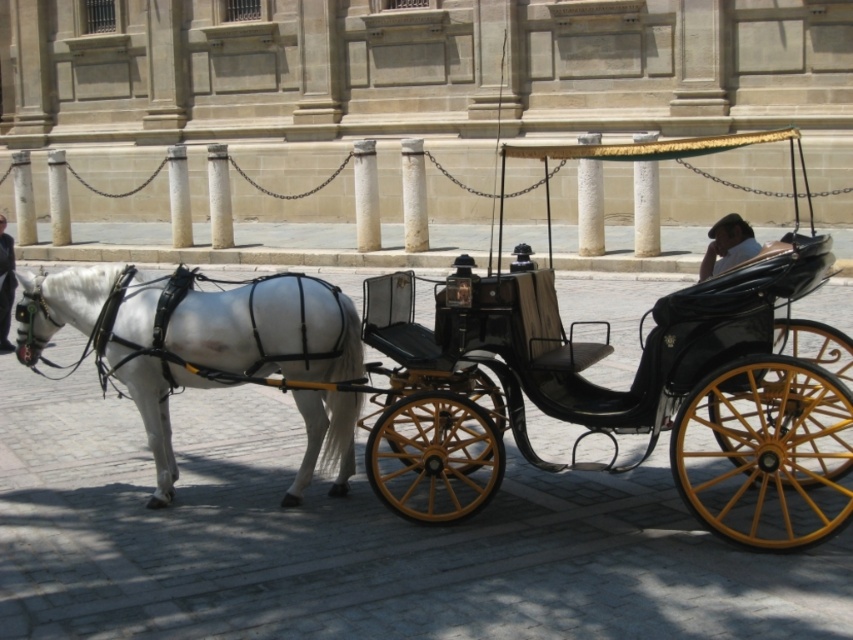
Question: Can you confirm if shiny black carriage at center is positioned to the right of light brown leather hat at upper right?

Choices:
 (A) yes
 (B) no

Answer: (B)

Question: Which object is closer to the camera taking this photo?

Choices:
 (A) white glossy horse at left
 (B) light brown leather hat at upper right
 (C) dark blue leather jacket at center

Answer: (B)

Question: Which object is farther from the camera taking this photo?

Choices:
 (A) white glossy horse at left
 (B) shiny black carriage at center
 (C) light brown leather hat at upper right

Answer: (A)

Question: Can you confirm if shiny black carriage at center is positioned to the right of light brown leather hat at upper right?

Choices:
 (A) no
 (B) yes

Answer: (A)

Question: Which object is closer to the camera taking this photo?

Choices:
 (A) light brown leather hat at upper right
 (B) dark blue leather jacket at center

Answer: (A)

Question: Is white glossy horse at left below dark blue leather jacket at center?

Choices:
 (A) yes
 (B) no

Answer: (A)